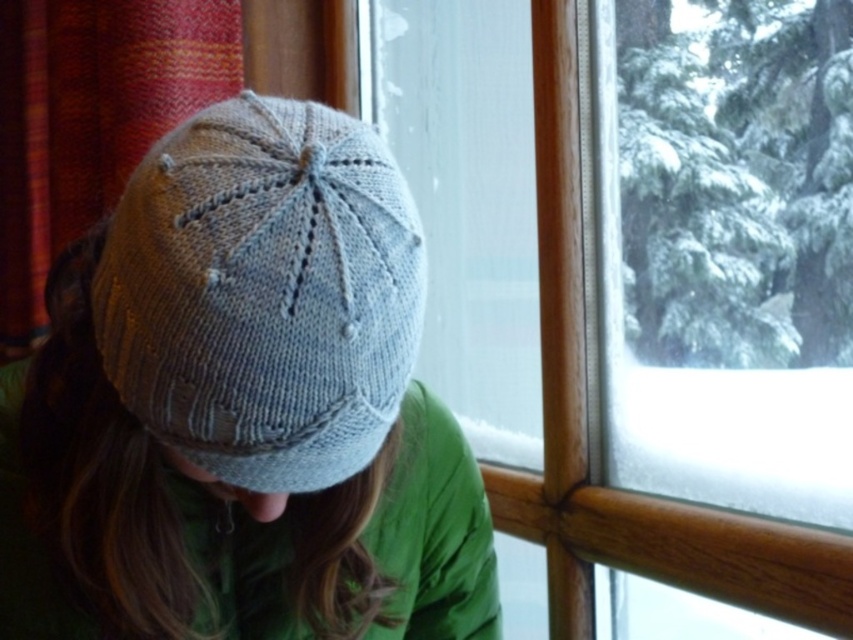
Question: Among these points, which one is nearest to the camera?

Choices:
 (A) (407, 128)
 (B) (231, 346)

Answer: (B)

Question: Does knitted woolen hat at center have a larger size compared to knitted gray hat at center?

Choices:
 (A) yes
 (B) no

Answer: (A)

Question: Does transparent glass window at center appear under knitted gray hat at center?

Choices:
 (A) yes
 (B) no

Answer: (B)

Question: Estimate the real-world distances between objects in this image. Which object is farther from the knitted woolen hat at center?

Choices:
 (A) knitted gray hat at center
 (B) transparent glass window at center

Answer: (B)

Question: Based on their relative distances, which object is nearer to the knitted woolen hat at center?

Choices:
 (A) transparent glass window at center
 (B) knitted gray hat at center

Answer: (B)

Question: Is transparent glass window at center closer to the viewer compared to knitted woolen hat at center?

Choices:
 (A) yes
 (B) no

Answer: (B)